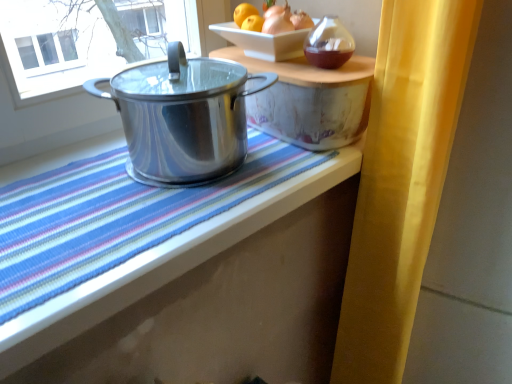
The width and height of the screenshot is (512, 384). Identify the location of vacant region above shiny metallic pot at center, which ranks as the first table in left-to-right order (from a real-world perspective). (128, 183).